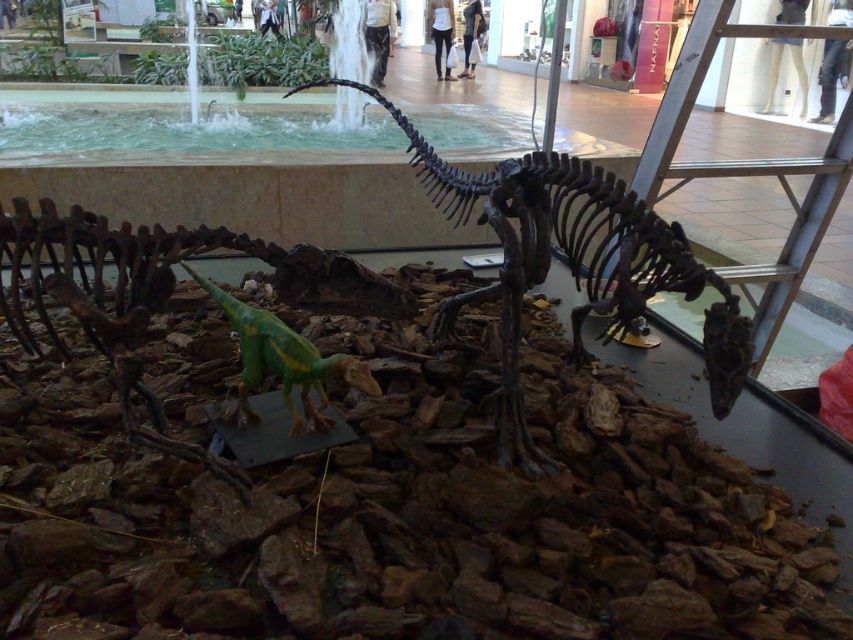
Question: Is brown metallic skeleton at center thinner than metallic silver ladder at right?

Choices:
 (A) no
 (B) yes

Answer: (B)

Question: Which object is the farthest from the metallic silver ladder at right?

Choices:
 (A) green matte plastic dinosaur at center
 (B) brown metallic skeleton at center

Answer: (A)

Question: Does brown metallic skeleton at center appear on the left side of metallic silver ladder at right?

Choices:
 (A) yes
 (B) no

Answer: (A)

Question: Does metallic silver ladder at right appear over green matte plastic dinosaur at center?

Choices:
 (A) yes
 (B) no

Answer: (A)

Question: Which of these objects is positioned farthest from the metallic silver ladder at right?

Choices:
 (A) brown metallic skeleton at center
 (B) green matte plastic dinosaur at center

Answer: (B)

Question: Based on their relative distances, which object is farther from the brown metallic skeleton at center?

Choices:
 (A) green matte plastic dinosaur at center
 (B) metallic silver ladder at right

Answer: (A)